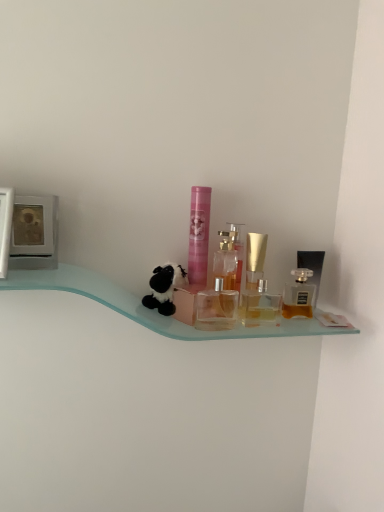
Question: Considering the relative sizes of pink matte tube at center, acting as the 1th toiletry starting from the left, and golden glass perfume at right, placed as the 1th perfume when sorted from right to left, in the image provided, is pink matte tube at center, acting as the 1th toiletry starting from the left, taller than golden glass perfume at right, placed as the 1th perfume when sorted from right to left,?

Choices:
 (A) no
 (B) yes

Answer: (B)

Question: Considering the relative sizes of pink matte tube at center, marked as the 3th toiletry in a right-to-left arrangement, and golden glass perfume at right, the 3th perfume viewed from the left, in the image provided, is pink matte tube at center, marked as the 3th toiletry in a right-to-left arrangement, bigger than golden glass perfume at right, the 3th perfume viewed from the left,?

Choices:
 (A) yes
 (B) no

Answer: (A)

Question: From a real-world perspective, does pink matte tube at center, acting as the 1th toiletry starting from the left, sit lower than golden glass perfume at right, placed as the 1th perfume when sorted from right to left?

Choices:
 (A) yes
 (B) no

Answer: (B)

Question: Is pink matte tube at center, acting as the 1th toiletry starting from the left, at the left side of golden glass perfume at right, placed as the 1th perfume when sorted from right to left?

Choices:
 (A) yes
 (B) no

Answer: (A)

Question: Considering the relative positions of pink matte tube at center, marked as the 3th toiletry in a right-to-left arrangement, and golden glass perfume at right, placed as the 1th perfume when sorted from right to left, in the image provided, is pink matte tube at center, marked as the 3th toiletry in a right-to-left arrangement, to the right of golden glass perfume at right, placed as the 1th perfume when sorted from right to left, from the viewer's perspective?

Choices:
 (A) yes
 (B) no

Answer: (B)

Question: From the image's perspective, is pink matte tube at center, marked as the 3th toiletry in a right-to-left arrangement, located above or below transparent plastic perfume bottles at center, which appears as the 2th toiletry when viewed from the right?

Choices:
 (A) above
 (B) below

Answer: (A)

Question: Is pink matte tube at center, acting as the 1th toiletry starting from the left, to the left or to the right of transparent plastic perfume bottles at center, which appears as the 2th toiletry when viewed from the right, in the image?

Choices:
 (A) right
 (B) left

Answer: (B)

Question: Based on their sizes in the image, would you say pink matte tube at center, acting as the 1th toiletry starting from the left, is bigger or smaller than transparent plastic perfume bottles at center, which appears as the 2th toiletry when viewed from the right?

Choices:
 (A) small
 (B) big

Answer: (B)

Question: Is pink matte tube at center, acting as the 1th toiletry starting from the left, inside or outside of transparent plastic perfume bottles at center, which appears as the 2th toiletry when viewed from the right?

Choices:
 (A) inside
 (B) outside

Answer: (B)

Question: Considering their positions, is transparent plastic perfume bottles at center, which appears as the 2th toiletry when viewed from the right, located in front of or behind black plush toy at center?

Choices:
 (A) behind
 (B) front

Answer: (A)

Question: Considering the positions of transparent plastic perfume bottles at center, which ranks as the second toiletry in left-to-right order, and black plush toy at center in the image, is transparent plastic perfume bottles at center, which ranks as the second toiletry in left-to-right order, wider or thinner than black plush toy at center?

Choices:
 (A) thin
 (B) wide

Answer: (A)

Question: Is point (264, 305) closer or farther from the camera than point (168, 279)?

Choices:
 (A) farther
 (B) closer

Answer: (A)

Question: From the image's perspective, is transparent plastic perfume bottles at center, which ranks as the second toiletry in left-to-right order, located above or below black plush toy at center?

Choices:
 (A) below
 (B) above

Answer: (A)

Question: Relative to clear glass perfume at center, which is counted as the 1th perfume, starting from the left, is transparent plastic perfume bottles at center, which ranks as the second toiletry in left-to-right order, in front or behind?

Choices:
 (A) behind
 (B) front

Answer: (B)

Question: Is transparent plastic perfume bottles at center, which appears as the 2th toiletry when viewed from the right, to the left or to the right of clear glass perfume at center, which is counted as the 1th perfume, starting from the left, in the image?

Choices:
 (A) left
 (B) right

Answer: (B)